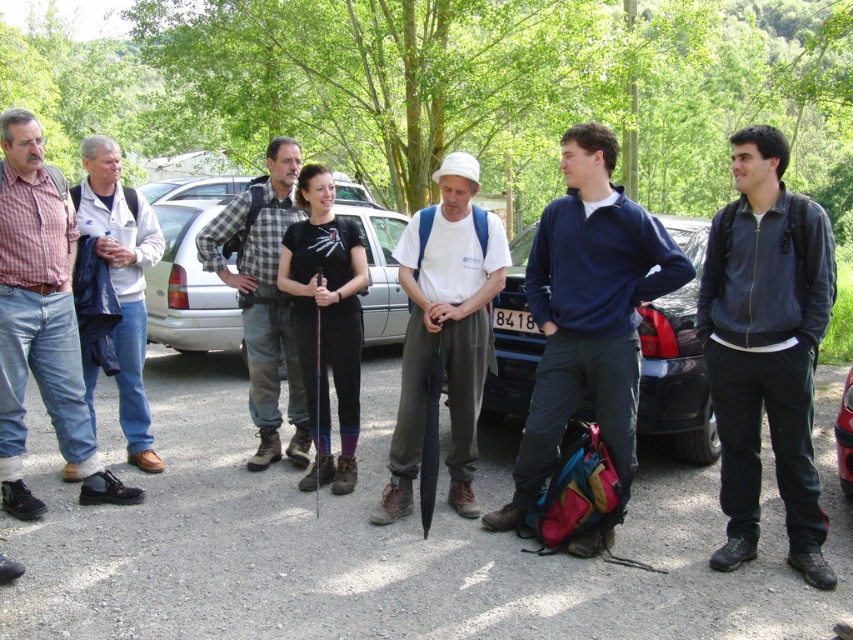
Is point (788, 474) farther from camera compared to point (259, 260)?

No, (788, 474) is in front of (259, 260).

Who is more forward, (708, 260) or (244, 317)?

Point (708, 260)

Describe the element at coordinates (766, 348) in the screenshot. I see `dark blue jacket at right` at that location.

At what (x,y) coordinates should I click in order to perform the action: click on dark blue jacket at right. Please return your answer as a coordinate pair (x, y). This screenshot has height=640, width=853. Looking at the image, I should click on (766, 348).

Which is more to the left, plaid fabric shirt at center or white cotton jacket at left?

Positioned to the left is white cotton jacket at left.

Is plaid fabric shirt at center closer to camera compared to white cotton jacket at left?

No, plaid fabric shirt at center is further to the viewer.

Who is more distant from viewer, (259, 291) or (102, 140)?

The point (259, 291) is more distant.

Where is `plaid fabric shirt at center`? The height and width of the screenshot is (640, 853). plaid fabric shirt at center is located at coordinates (263, 298).

Which is behind, point (809, 300) or point (148, 282)?

Point (148, 282)

Where is `dark blue jacket at right`? Image resolution: width=853 pixels, height=640 pixels. dark blue jacket at right is located at coordinates click(x=766, y=348).